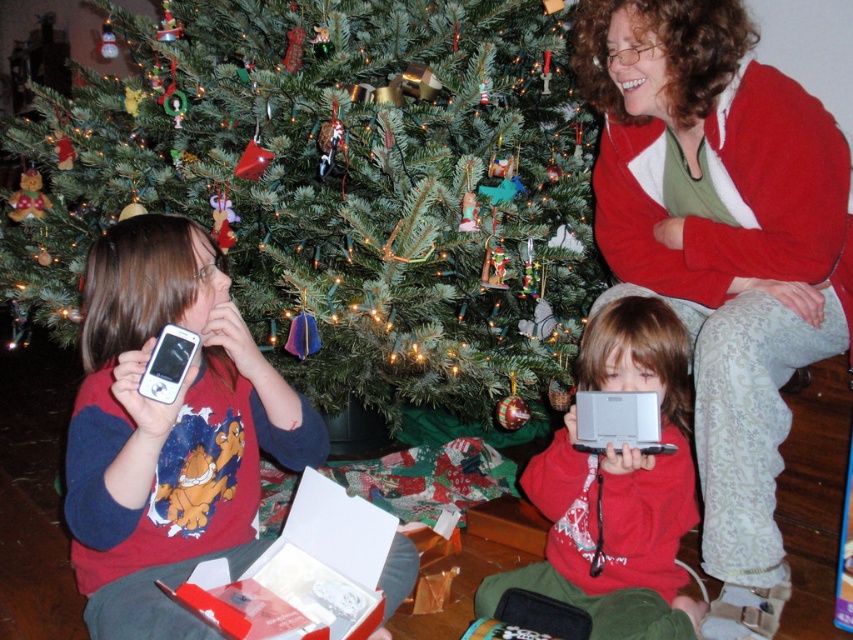
You are a parent trying to locate your child who is sitting near the green matte christmas tree at center and the silver metallic handheld device at center. Which object should you look to your left of to find the child?

The green matte christmas tree at center is positioned on the left side of silver metallic handheld device at center, so the child is likely sitting to the left of the silver metallic handheld device at center, near the green matte christmas tree at center.